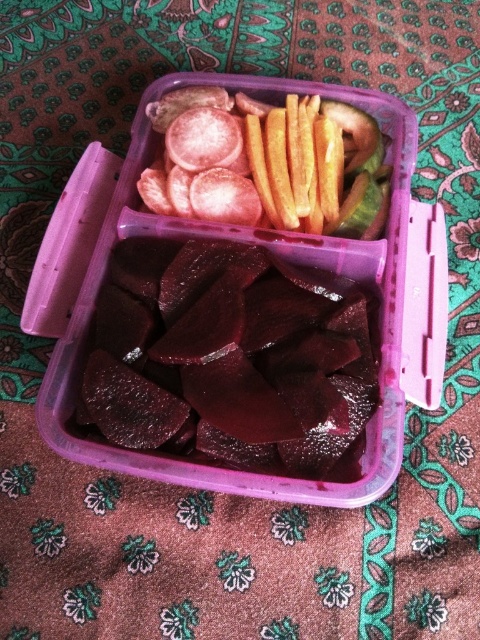
You are a food delivery person who needs to place an order for a customer. The customer ordered both dark red glossy beets at center and smooth yellow french fries at center. The delivery box has limited space. Which item should you place first to maximize space efficiency?

The dark red glossy beets at center is larger in size than smooth yellow french fries at center, so you should place the dark red glossy beets at center first to make space for the smaller smooth yellow french fries at center.

You are a food delivery person who needs to stack two containers on top of each other. The first container has dark red glossy beets at center and the second has smooth yellow french fries at center. Based on their heights, which container should be placed at the bottom to prevent the stack from tipping over?

The dark red glossy beets at center has a greater height compared to smooth yellow french fries at center. Therefore, the container with dark red glossy beets at center should be placed at the bottom to provide a stable base for the stack.